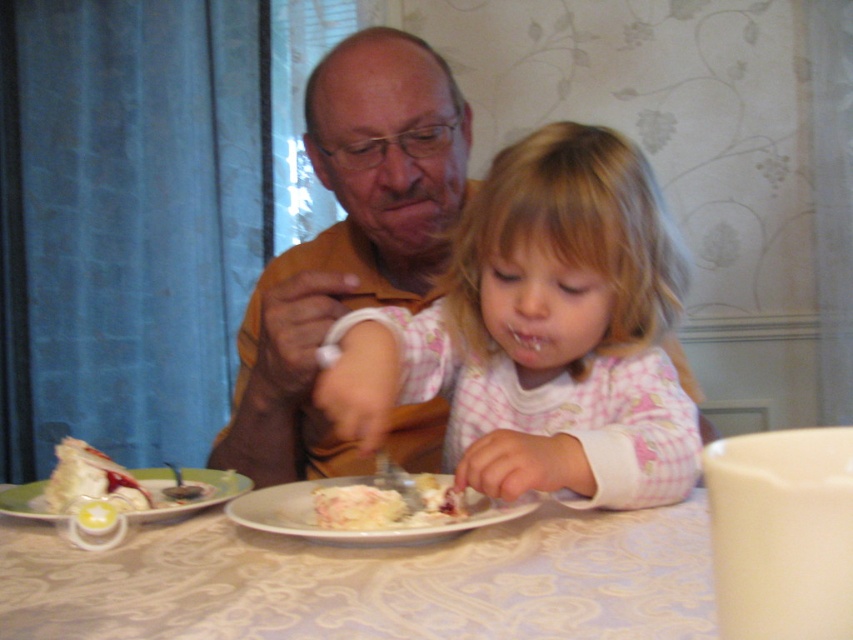
Is white matte plate at center positioned before white creamy cake at lower left?

That is True.

The width and height of the screenshot is (853, 640). I want to click on white matte plate at center, so click(x=349, y=531).

Is the position of white lace tablecloth at center more distant than that of white creamy cake at center?

No, it is not.

Which is more to the right, white lace tablecloth at center or white creamy cake at center?

Positioned to the right is white creamy cake at center.

Who is more forward, (225, 637) or (390, 500)?

Positioned in front is point (225, 637).

The height and width of the screenshot is (640, 853). Identify the location of white lace tablecloth at center. (368, 580).

Which of these two, white matte plate at center or white creamy cake at center, stands taller?

white matte plate at center

What do you see at coordinates (349, 531) in the screenshot? I see `white matte plate at center` at bounding box center [349, 531].

The image size is (853, 640). Identify the location of white matte plate at center. (349, 531).

The height and width of the screenshot is (640, 853). In order to click on white matte plate at center in this screenshot , I will do `click(349, 531)`.